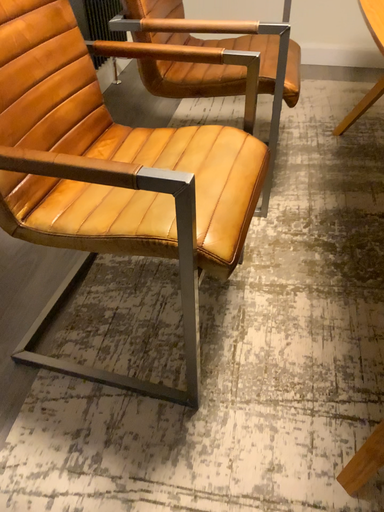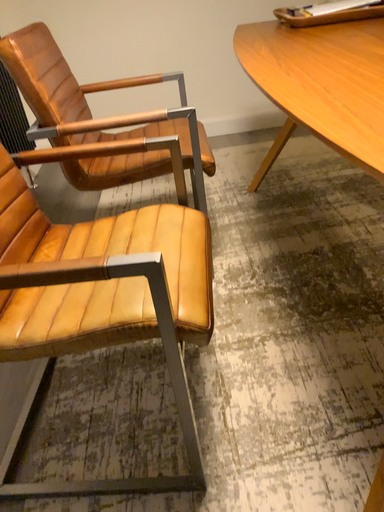
Question: How did the camera likely rotate when shooting the video?

Choices:
 (A) rotated right
 (B) rotated left

Answer: (A)